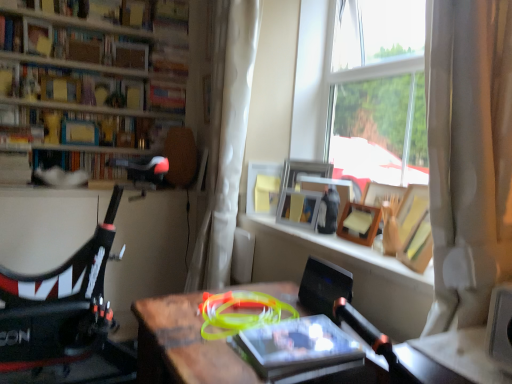
Identify the location of free space above translucent plastic book at center, which is the 1th book from bottom to top (from a real-world perspective). coord(289,338).